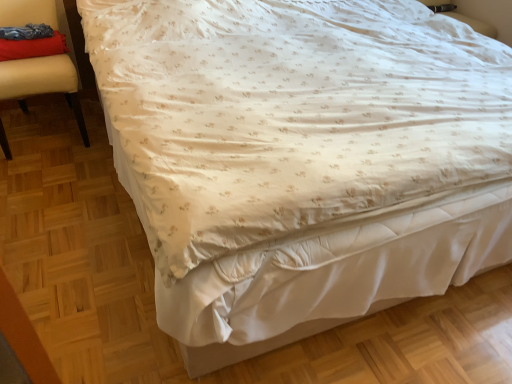
What do you see at coordinates (42, 82) in the screenshot? I see `velvet red cushion at left` at bounding box center [42, 82].

Where is `velvet red cushion at left`? The image size is (512, 384). velvet red cushion at left is located at coordinates (42, 82).

What do you see at coordinates (30, 42) in the screenshot? This screenshot has height=384, width=512. I see `velvet red pillow at upper left` at bounding box center [30, 42].

Measure the distance between point (56, 31) and camera.

The distance of point (56, 31) from camera is 2.40 meters.

Locate an element on the screen. The image size is (512, 384). velvet red pillow at upper left is located at coordinates (30, 42).

This screenshot has width=512, height=384. I want to click on velvet red cushion at left, so (42, 82).

Would you say velvet red cushion at left is to the left or to the right of velvet red pillow at upper left in the picture?

velvet red cushion at left is positioned on velvet red pillow at upper left's left side.

Considering the relative positions of velvet red cushion at left and velvet red pillow at upper left in the image provided, is velvet red cushion at left behind velvet red pillow at upper left?

No, velvet red cushion at left is in front of velvet red pillow at upper left.

Does point (51, 63) lie in front of point (26, 48)?

No, (51, 63) is further to viewer.

From the image's perspective, between velvet red cushion at left and velvet red pillow at upper left, who is located below?

velvet red cushion at left appears lower in the image.

From a real-world perspective, which is physically above, velvet red cushion at left or velvet red pillow at upper left?

velvet red pillow at upper left, from a real-world perspective.

Considering the relative sizes of velvet red cushion at left and velvet red pillow at upper left in the image provided, is velvet red cushion at left thinner than velvet red pillow at upper left?

In fact, velvet red cushion at left might be wider than velvet red pillow at upper left.

In the scene shown: Considering the sizes of objects velvet red cushion at left and velvet red pillow at upper left in the image provided, who is taller, velvet red cushion at left or velvet red pillow at upper left?

velvet red cushion at left is taller.

Consider the image. Who is smaller, velvet red cushion at left or velvet red pillow at upper left?

Smaller between the two is velvet red pillow at upper left.

Would you say velvet red pillow at upper left is part of velvet red cushion at left's contents?

Yes, velvet red pillow at upper left is a part of velvet red cushion at left.

Is velvet red cushion at left not close to velvet red pillow at upper left?

That's not correct — velvet red cushion at left is a little close to velvet red pillow at upper left.

Could you tell me if velvet red cushion at left is turned towards velvet red pillow at upper left?

Yes, velvet red cushion at left faces towards velvet red pillow at upper left.

I want to click on chair that is on the left side of velvet red pillow at upper left, so click(x=42, y=82).

Which object is positioned more to the right, velvet red pillow at upper left or velvet red cushion at left?

From the viewer's perspective, velvet red pillow at upper left appears more on the right side.

In the scene shown: Is velvet red pillow at upper left further to camera compared to velvet red cushion at left?

Yes, velvet red pillow at upper left is further from the viewer.

Which is behind, point (30, 42) or point (48, 83)?

The point (30, 42) is farther.

From the image's perspective, is velvet red pillow at upper left located beneath velvet red cushion at left?

No, from the image's perspective, velvet red pillow at upper left is not below velvet red cushion at left.

Consider the image. From a real-world perspective, is velvet red pillow at upper left beneath velvet red cushion at left?

No.

Between velvet red pillow at upper left and velvet red cushion at left, which one has larger width?

With larger width is velvet red cushion at left.

Does velvet red pillow at upper left have a lesser height compared to velvet red cushion at left?

Yes, velvet red pillow at upper left is shorter than velvet red cushion at left.

Can you confirm if velvet red pillow at upper left is smaller than velvet red cushion at left?

Yes.

Is velvet red pillow at upper left surrounding velvet red cushion at left?

No, velvet red cushion at left is not a part of velvet red pillow at upper left.

Is velvet red pillow at upper left not close to velvet red cushion at left?

No.

Is velvet red pillow at upper left looking in the opposite direction of velvet red cushion at left?

Yes, velvet red pillow at upper left's orientation is away from velvet red cushion at left.

How different are the orientations of velvet red pillow at upper left and velvet red cushion at left in degrees?

There is a 0.449-degree angle between the facing directions of velvet red pillow at upper left and velvet red cushion at left.

Where is `pillow that is behind the velvet red cushion at left`? pillow that is behind the velvet red cushion at left is located at coordinates (30, 42).

The height and width of the screenshot is (384, 512). What are the coordinates of `chair below the velvet red pillow at upper left (from a real-world perspective)` in the screenshot? It's located at (42, 82).

What are the coordinates of `chair below the velvet red pillow at upper left (from the image's perspective)` in the screenshot? It's located at (42, 82).